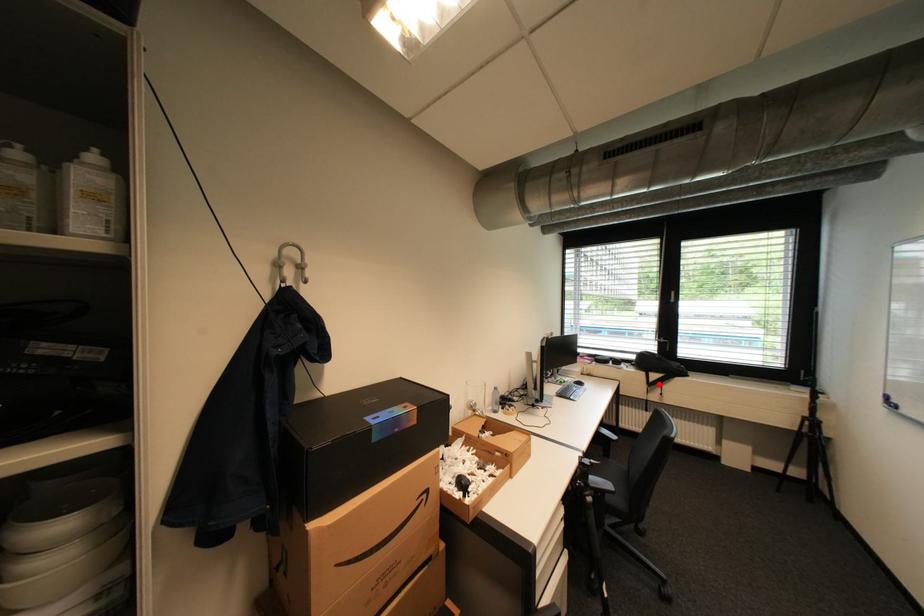
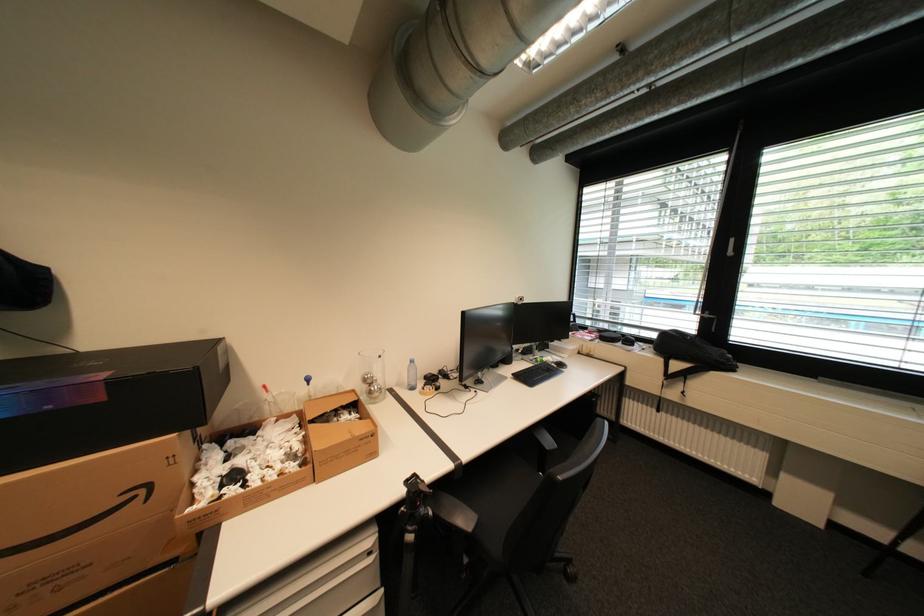
Question: I am providing you with two images of the same scene from different viewpoints. A red point is shown in image1. For the corresponding object point in image2, is it positioned nearer or farther from the camera?

Choices:
 (A) Nearer
 (B) Farther

Answer: (A)